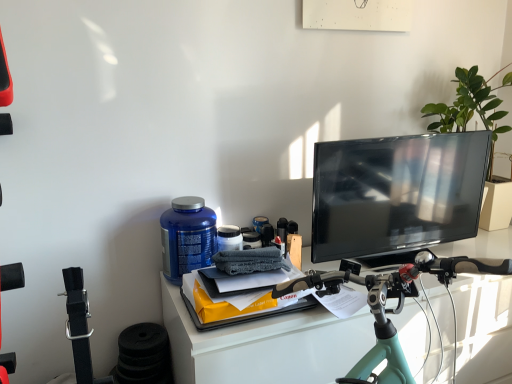
Describe the element at coordinates (385, 304) in the screenshot. I see `teal matte bicycle handlebars at center` at that location.

The image size is (512, 384). Identify the location of blue plastic bottle at center-left. (187, 237).

The width and height of the screenshot is (512, 384). I want to click on teal matte bicycle handlebars at center, so click(385, 304).

Is teal matte bicycle handlebars at center wider than blue plastic bottle at center-left?

Yes, teal matte bicycle handlebars at center is wider than blue plastic bottle at center-left.

Between teal matte bicycle handlebars at center and blue plastic bottle at center-left, which one has less height?

blue plastic bottle at center-left.

From the image's perspective, is teal matte bicycle handlebars at center positioned above or below blue plastic bottle at center-left?

teal matte bicycle handlebars at center is situated lower than blue plastic bottle at center-left in the image.

In terms of size, does teal matte bicycle handlebars at center appear bigger or smaller than blue plastic bottle at center-left?

teal matte bicycle handlebars at center is bigger than blue plastic bottle at center-left.

In terms of width, does blue plastic bottle at center-left look wider or thinner when compared to teal matte bicycle handlebars at center?

blue plastic bottle at center-left is thinner than teal matte bicycle handlebars at center.

Does blue plastic bottle at center-left have a greater height compared to teal matte bicycle handlebars at center?

In fact, blue plastic bottle at center-left may be shorter than teal matte bicycle handlebars at center.

Is blue plastic bottle at center-left at the right side of teal matte bicycle handlebars at center?

Incorrect, blue plastic bottle at center-left is not on the right side of teal matte bicycle handlebars at center.

From the image's perspective, is blue plastic bottle at center-left above teal matte bicycle handlebars at center?

Yes, from the image's perspective, blue plastic bottle at center-left is over teal matte bicycle handlebars at center.

What's the angular difference between blue plastic bottle at center-left and matte black tv at right's facing directions?

The angular difference between blue plastic bottle at center-left and matte black tv at right is 5.88 degrees.

Between blue plastic bottle at center-left and matte black tv at right, which one has smaller width?

Thinner between the two is matte black tv at right.

Between blue plastic bottle at center-left and matte black tv at right, which one appears on the right side from the viewer's perspective?

matte black tv at right.

Is blue plastic bottle at center-left beside matte black tv at right?

blue plastic bottle at center-left is not next to matte black tv at right, and they're not touching.

Does teal matte bicycle handlebars at center appear on the left side of green leafy plant at upper right?

Indeed, teal matte bicycle handlebars at center is positioned on the left side of green leafy plant at upper right.

From the image's perspective, is teal matte bicycle handlebars at center on green leafy plant at upper right?

No.

Could you tell me if teal matte bicycle handlebars at center is turned towards green leafy plant at upper right?

No, teal matte bicycle handlebars at center is not aimed at green leafy plant at upper right.

Considering the positions of points (378, 358) and (494, 182), is point (378, 358) farther from camera compared to point (494, 182)?

No, (378, 358) is closer to viewer.

Who is bigger, green leafy plant at upper right or teal matte bicycle handlebars at center?

teal matte bicycle handlebars at center is bigger.

From a real-world perspective, between green leafy plant at upper right and teal matte bicycle handlebars at center, who is vertically lower?

teal matte bicycle handlebars at center.

In terms of height, does green leafy plant at upper right look taller or shorter compared to teal matte bicycle handlebars at center?

Considering their sizes, green leafy plant at upper right has less height than teal matte bicycle handlebars at center.

Is green leafy plant at upper right wider than teal matte bicycle handlebars at center?

In fact, green leafy plant at upper right might be narrower than teal matte bicycle handlebars at center.

Measure the distance from teal matte bicycle handlebars at center to matte black tv at right.

teal matte bicycle handlebars at center is 43.07 centimeters from matte black tv at right.

Is teal matte bicycle handlebars at center aimed at matte black tv at right?

No, teal matte bicycle handlebars at center is not facing towards matte black tv at right.

Which is correct: teal matte bicycle handlebars at center is inside matte black tv at right, or outside of it?

The correct answer is: outside.

Considering the sizes of objects teal matte bicycle handlebars at center and matte black tv at right in the image provided, who is shorter, teal matte bicycle handlebars at center or matte black tv at right?

matte black tv at right is shorter.

Which is correct: blue plastic bottle at center-left is inside green leafy plant at upper right, or outside of it?

blue plastic bottle at center-left is spatially situated outside green leafy plant at upper right.

The image size is (512, 384). I want to click on bottle in front of the green leafy plant at upper right, so click(187, 237).

From the image's perspective, is blue plastic bottle at center-left located beneath green leafy plant at upper right?

Yes, from the image's perspective, blue plastic bottle at center-left is beneath green leafy plant at upper right.

Looking at the image, does blue plastic bottle at center-left seem bigger or smaller compared to green leafy plant at upper right?

blue plastic bottle at center-left is smaller than green leafy plant at upper right.

Locate an element on the screen. This screenshot has height=384, width=512. bottle behind the teal matte bicycle handlebars at center is located at coordinates pos(187,237).

There is a teal matte bicycle handlebars at center. At what (x,y) coordinates should I click in order to perform the action: click on bottle above it (from a real-world perspective). Please return your answer as a coordinate pair (x, y). This screenshot has width=512, height=384. Looking at the image, I should click on (187, 237).

Looking at the image, which one is located closer to green leafy plant at upper right, teal matte bicycle handlebars at center or blue plastic bottle at center-left?

Among the two, teal matte bicycle handlebars at center is located nearer to green leafy plant at upper right.

Based on their spatial positions, is matte black tv at right or blue plastic bottle at center-left closer to teal matte bicycle handlebars at center?

Based on the image, matte black tv at right appears to be nearer to teal matte bicycle handlebars at center.

When comparing their distances from green leafy plant at upper right, does matte black tv at right or blue plastic bottle at center-left seem closer?

matte black tv at right is closer to green leafy plant at upper right.

In the scene shown: Estimate the real-world distances between objects in this image. Which object is closer to blue plastic bottle at center-left, teal matte bicycle handlebars at center or green leafy plant at upper right?

Among the two, teal matte bicycle handlebars at center is located nearer to blue plastic bottle at center-left.

Based on their spatial positions, is green leafy plant at upper right or teal matte bicycle handlebars at center closer to matte black tv at right?

green leafy plant at upper right is positioned closer to the anchor matte black tv at right.

From the image, which object appears to be nearer to green leafy plant at upper right, matte black tv at right or teal matte bicycle handlebars at center?

Among the two, matte black tv at right is located nearer to green leafy plant at upper right.

Estimate the real-world distances between objects in this image. Which object is closer to matte black tv at right, green leafy plant at upper right or blue plastic bottle at center-left?

Among the two, green leafy plant at upper right is located nearer to matte black tv at right.

Which object lies nearer to the anchor point blue plastic bottle at center-left, matte black tv at right or teal matte bicycle handlebars at center?

Based on the image, teal matte bicycle handlebars at center appears to be nearer to blue plastic bottle at center-left.

Where is `bicycle situated between blue plastic bottle at center-left and green leafy plant at upper right from left to right`? bicycle situated between blue plastic bottle at center-left and green leafy plant at upper right from left to right is located at coordinates (385, 304).

Locate an element on the screen. television located between blue plastic bottle at center-left and green leafy plant at upper right in the left-right direction is located at coordinates (396, 195).

Identify the location of television between green leafy plant at upper right and teal matte bicycle handlebars at center vertically. (396, 195).

This screenshot has height=384, width=512. What are the coordinates of `bicycle between blue plastic bottle at center-left and matte black tv at right in the horizontal direction` in the screenshot? It's located at (385, 304).